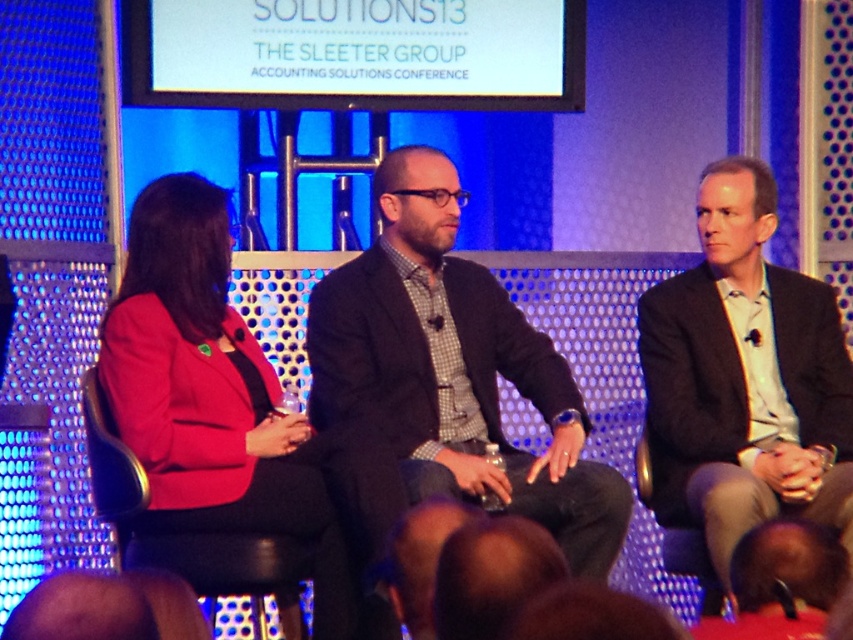
You are attending the conference and want to take a photo of the panel discussion. The camera you have can only focus on objects within a 0.2 radius around the center point. Will the matte red blazer at center be in focus?

The matte red blazer at center is at point (212, 396), which is within the 0.2 radius from the center point, so it will be in focus.